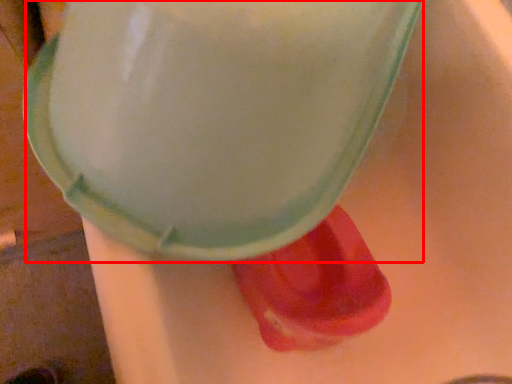
Question: From the image's perspective, where is foam (annotated by the red box) located in relation to footwear in the image?

Choices:
 (A) below
 (B) above

Answer: (B)